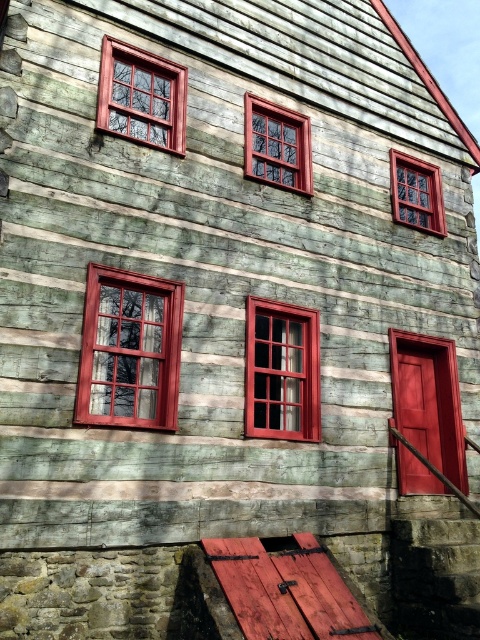
Question: Based on their relative distances, which object is farther from the matte wood window at center left?

Choices:
 (A) matte wood window at upper left
 (B) matte wood window at upper center
 (C) wooden window at center
 (D) matte wood window at center

Answer: (C)

Question: Where is matte wood window at center left located in relation to wooden window at center in the image?

Choices:
 (A) below
 (B) above

Answer: (A)

Question: Which object is positioned closest to the matte wood window at upper center?

Choices:
 (A) wooden window at center
 (B) matte wood window at upper left
 (C) matte wood window at center left
 (D) matte wood window at center

Answer: (B)

Question: Is the position of matte wood window at center left less distant than that of matte wood window at center?

Choices:
 (A) yes
 (B) no

Answer: (A)

Question: Does matte wood window at center left lie in front of matte wood window at upper center?

Choices:
 (A) yes
 (B) no

Answer: (A)

Question: Which object is the farthest from the matte wood window at upper center?

Choices:
 (A) matte wood window at center
 (B) matte wood window at center left
 (C) wooden window at center
 (D) matte wood window at upper left

Answer: (B)